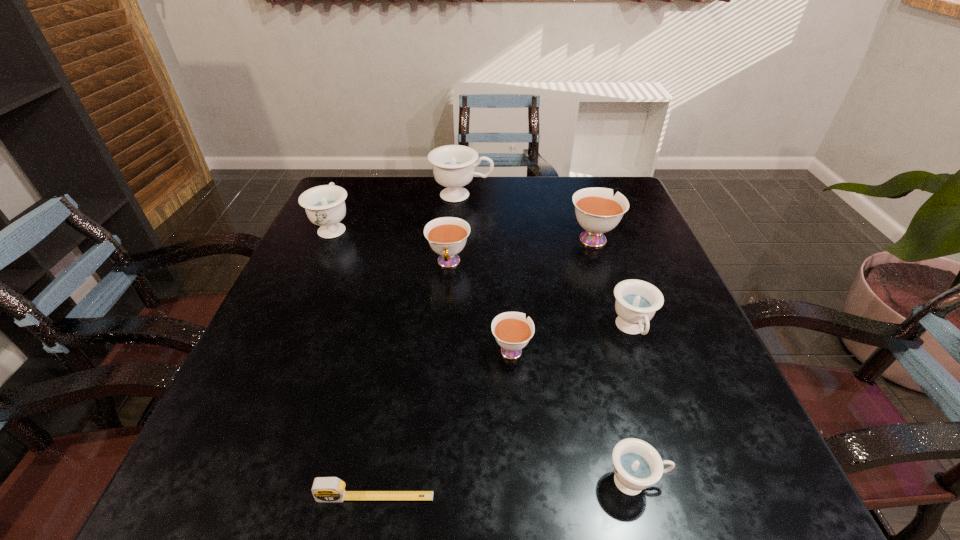
What are the coordinates of `the farthest object` in the screenshot? It's located at (453, 165).

I want to click on the biggest blue teacup, so click(x=453, y=165).

Find the location of `the rightmost white teacup`. the rightmost white teacup is located at coordinates (597, 211).

Locate an element on the screen. the second farthest blue teacup is located at coordinates (324, 205).

You are a GUI agent. You are given a task and a screenshot of the screen. Output one action in this format:
    pyautogui.click(x=<x>, y=<y>)
    Task: Click on the leftmost teacup
    This screenshot has height=540, width=960.
    Given the screenshot: What is the action you would take?
    pyautogui.click(x=324, y=205)

Identify the location of the leftmost white teacup. (447, 236).

The width and height of the screenshot is (960, 540). What are the coordinates of `the third biggest blue teacup` in the screenshot? It's located at (637, 301).

Identify the location of the nearest white teacup. (512, 331).

The width and height of the screenshot is (960, 540). What are the coordinates of `the smallest white teacup` in the screenshot? It's located at (512, 331).

This screenshot has height=540, width=960. In order to click on the smallest blue teacup in this screenshot , I will do `click(637, 465)`.